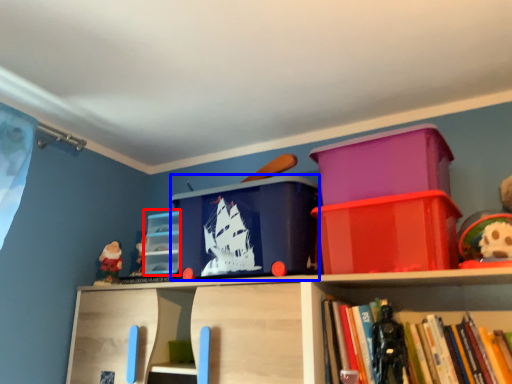
Question: Which of the following is the farthest to the observer, storage box (highlighted by a red box) or storage box (highlighted by a blue box)?

Choices:
 (A) storage box
 (B) storage box

Answer: (A)